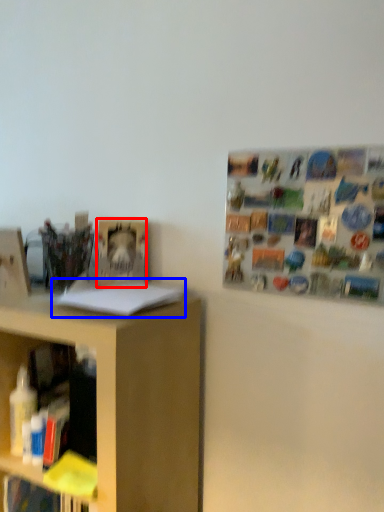
Question: Which point is further to the camera, book (highlighted by a red box) or book (highlighted by a blue box)?

Choices:
 (A) book
 (B) book

Answer: (A)